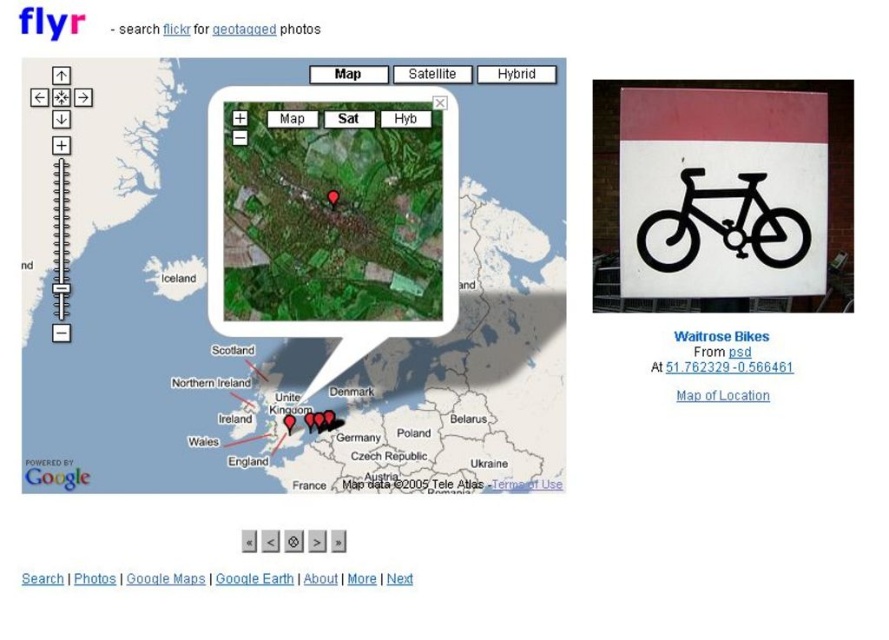
Does white matte bicycle sign at center appear over white paper sign at center?

Yes.

Does white matte bicycle sign at center appear under white paper sign at center?

No.

Between point (449, 134) and point (709, 392), which one is positioned behind?

Point (449, 134)

Where is `white matte bicycle sign at center`? The height and width of the screenshot is (640, 889). white matte bicycle sign at center is located at coordinates (331, 205).

Can you confirm if white matte signboard at center is wider than black matte bicycle at center?

Yes.

Who is more forward, [223,154] or [661,266]?

Point [223,154] is more forward.

Locate an element on the screen. white matte signboard at center is located at coordinates (294, 275).

Locate an element on the screen. The image size is (889, 640). white matte signboard at center is located at coordinates (294, 275).

Is white matte signboard at center closer to the viewer compared to white matte bicycle sign at center?

Yes, white matte signboard at center is closer to the viewer.

Is white matte signboard at center to the left of white matte bicycle sign at center from the viewer's perspective?

Correct, you'll find white matte signboard at center to the left of white matte bicycle sign at center.

Is point (179, 403) positioned in front of point (453, 282)?

Yes, it is.

At what (x,y) coordinates should I click in order to perform the action: click on white matte signboard at center. Please return your answer as a coordinate pair (x, y). Looking at the image, I should click on tap(294, 275).